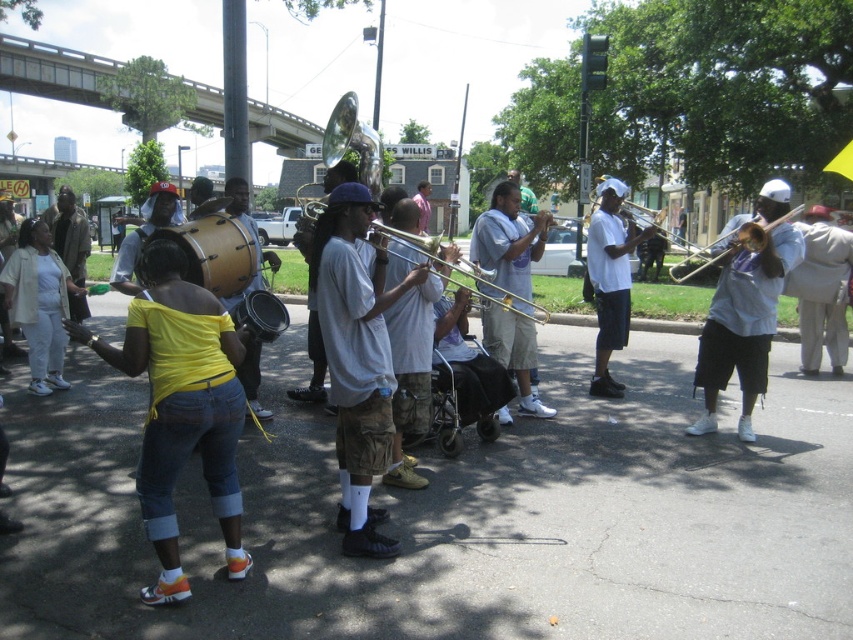
You are standing on the street where the musicians are performing. There are two points marked in the image, one at coordinates point (372, 547) and another at point (802, 308). Which point is closer to your current position?

Point (372, 547) is closer to the camera than point (802, 308), so the point at coordinates point (372, 547) is closer to your current position.

You are a photographer trying to capture both the white cotton shirt at center and the light beige suit at center in a single frame. Given their sizes, which one will you need to position closer to the camera to ensure both fit well in the photo?

Since the white cotton shirt at center occupies less space than the light beige suit at center, you should position the light beige suit at center closer to the camera to ensure both fit well in the photo.